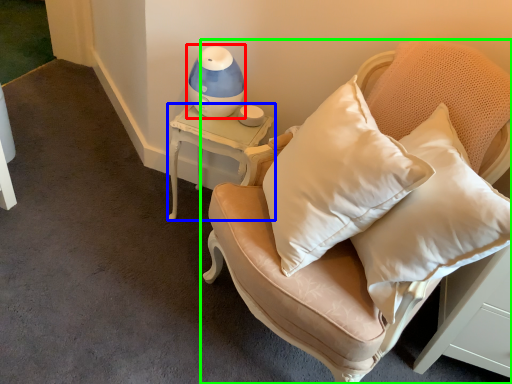
Question: Based on their relative distances, which object is nearer to table lamp (highlighted by a red box)? Choose from table (highlighted by a blue box) and furniture (highlighted by a green box).

Choices:
 (A) table
 (B) furniture

Answer: (A)